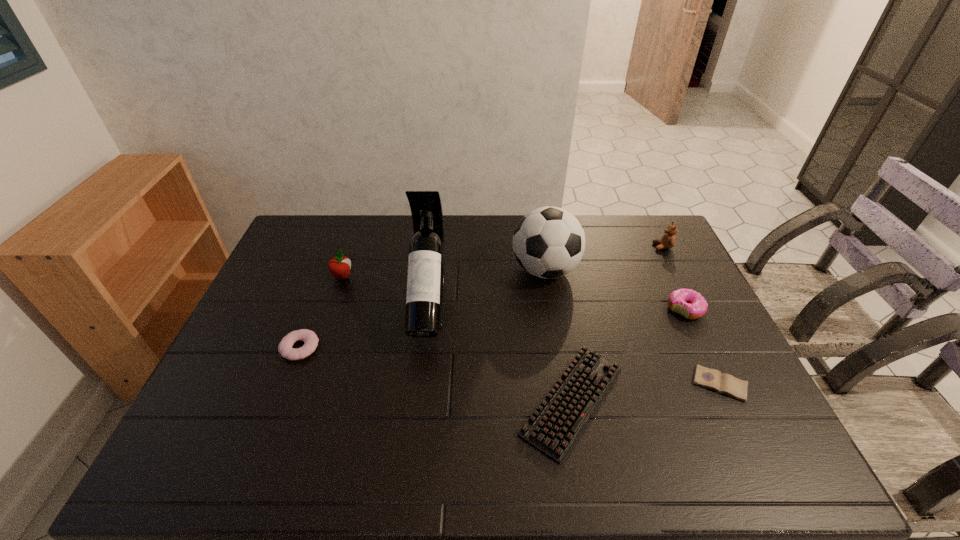
I want to click on vacant space that is in between the taller doughnut and the teddy bear, so click(674, 278).

This screenshot has width=960, height=540. I want to click on object that is the sixth closest one to the diary, so click(310, 339).

Identify the location of object that is the second closest one to the apple. (426, 265).

Where is `vacant space that satisfies the following two spatial constraints: 1. on the back side of the farther doughnut; 2. on the left side of the seventh tallest object`? The width and height of the screenshot is (960, 540). vacant space that satisfies the following two spatial constraints: 1. on the back side of the farther doughnut; 2. on the left side of the seventh tallest object is located at coordinates (557, 309).

Locate an element on the screen. The width and height of the screenshot is (960, 540). free space in the image that satisfies the following two spatial constraints: 1. on the back side of the soccer ball; 2. on the right side of the third shortest object is located at coordinates (330, 270).

Locate an element on the screen. The height and width of the screenshot is (540, 960). vacant space that satisfies the following two spatial constraints: 1. on the back side of the seventh shortest object; 2. on the left side of the apple is located at coordinates (345, 270).